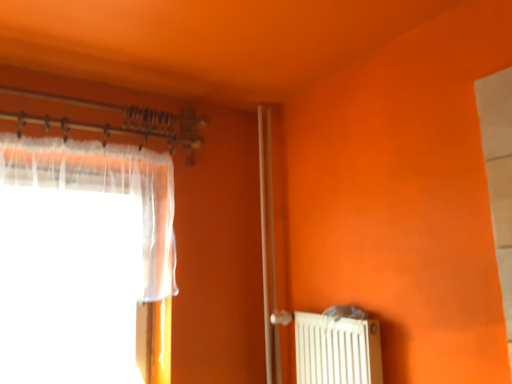
Question: From a real-world perspective, is white matte radiator at lower right positioned above or below translucent fabric curtain at left?

Choices:
 (A) above
 (B) below

Answer: (B)

Question: From their relative heights in the image, would you say white matte radiator at lower right is taller or shorter than translucent fabric curtain at left?

Choices:
 (A) short
 (B) tall

Answer: (A)

Question: Which of these objects is positioned farthest from the translucent fabric curtain at left?

Choices:
 (A) clear glass screen door at center
 (B) white matte radiator at lower right

Answer: (B)

Question: Which object is the farthest from the white matte radiator at lower right?

Choices:
 (A) translucent fabric curtain at left
 (B) clear glass screen door at center

Answer: (A)